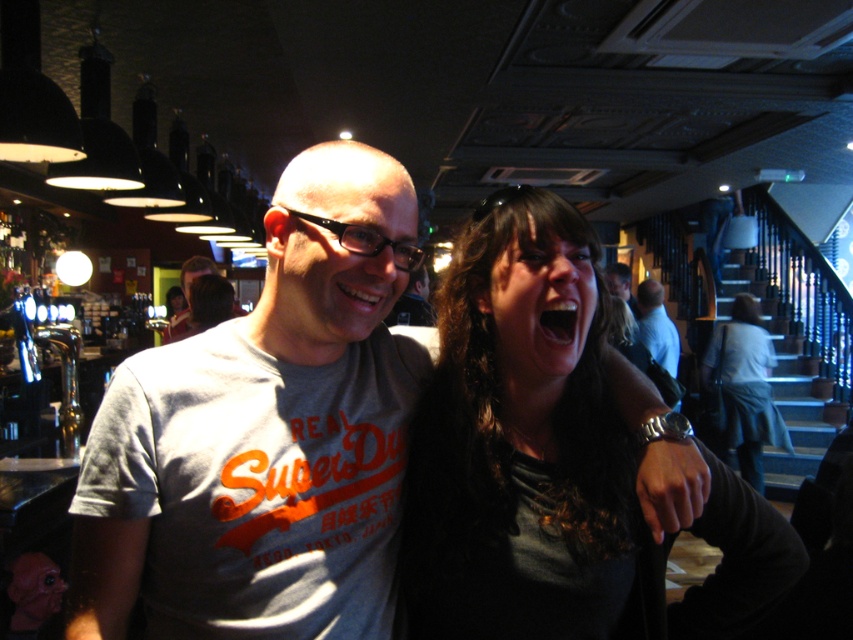
Question: Estimate the real-world distances between objects in this image. Which object is closer to the smooth black shirt at upper center?

Choices:
 (A) gray cotton t-shirt at center
 (B) dark gray fabric skirt at right

Answer: (B)

Question: Which object is the closest to the dark brown hair at center?

Choices:
 (A) smooth black shirt at upper center
 (B) dark gray fabric skirt at right

Answer: (A)

Question: Observing the image, what is the correct spatial positioning of gray cotton t-shirt at center in reference to smooth black shirt at upper center?

Choices:
 (A) below
 (B) above

Answer: (A)

Question: Observing the image, what is the correct spatial positioning of gray cotton t-shirt at center in reference to dark brown hair at center?

Choices:
 (A) below
 (B) above

Answer: (B)

Question: Does dark brown hair at center appear on the left side of blue shirt at center?

Choices:
 (A) no
 (B) yes

Answer: (B)

Question: Which point is farther to the camera?

Choices:
 (A) dark brown hair at center
 (B) gray cotton t-shirt at center

Answer: (A)